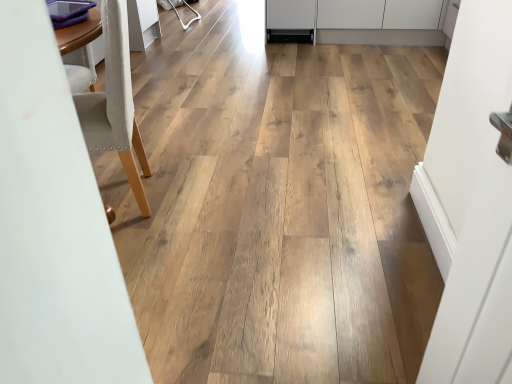
Where is `vacant area on the back side of white fabric chair at left`? This screenshot has height=384, width=512. vacant area on the back side of white fabric chair at left is located at coordinates (173, 153).